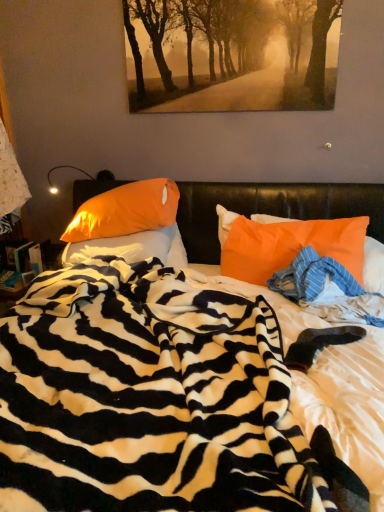
Question: Does blue striped fabric at center have a smaller size compared to zebra-patterned blanket at center?

Choices:
 (A) no
 (B) yes

Answer: (B)

Question: From a real-world perspective, does blue striped fabric at center sit lower than zebra-patterned blanket at center?

Choices:
 (A) yes
 (B) no

Answer: (B)

Question: From a real-world perspective, is blue striped fabric at center on zebra-patterned blanket at center?

Choices:
 (A) no
 (B) yes

Answer: (B)

Question: Considering the relative sizes of blue striped fabric at center and zebra-patterned blanket at center in the image provided, is blue striped fabric at center shorter than zebra-patterned blanket at center?

Choices:
 (A) no
 (B) yes

Answer: (B)

Question: Does blue striped fabric at center turn towards zebra-patterned blanket at center?

Choices:
 (A) no
 (B) yes

Answer: (B)

Question: Is blue striped fabric at center taller than zebra-patterned blanket at center?

Choices:
 (A) yes
 (B) no

Answer: (B)

Question: Can you confirm if orange fabric pillow at right, which is counted as the third pillow, starting from the left, is positioned to the left of orange satin pillow at center, arranged as the first pillow when viewed from the left?

Choices:
 (A) no
 (B) yes

Answer: (A)

Question: Would you say orange fabric pillow at right, which is counted as the third pillow, starting from the left, is outside orange satin pillow at center, arranged as the first pillow when viewed from the left?

Choices:
 (A) no
 (B) yes

Answer: (B)

Question: Is orange fabric pillow at right, which is counted as the third pillow, starting from the left, to the right of orange satin pillow at center, arranged as the first pillow when viewed from the left, from the viewer's perspective?

Choices:
 (A) yes
 (B) no

Answer: (A)

Question: Is orange fabric pillow at right, which is counted as the third pillow, starting from the left, taller than orange satin pillow at center, arranged as the first pillow when viewed from the left?

Choices:
 (A) yes
 (B) no

Answer: (A)

Question: Are orange fabric pillow at right, which is counted as the third pillow, starting from the left, and orange satin pillow at center, which appears as the 3th pillow when viewed from the right, located far from each other?

Choices:
 (A) no
 (B) yes

Answer: (A)

Question: Is the depth of orange fabric pillow at right, acting as the 1th pillow starting from the right, greater than that of orange satin pillow at center, which appears as the 3th pillow when viewed from the right?

Choices:
 (A) yes
 (B) no

Answer: (B)

Question: From the image's perspective, does orange fabric pillow at right, which is counted as the third pillow, starting from the left, appear higher than golden textured pathway at upper center?

Choices:
 (A) yes
 (B) no

Answer: (B)